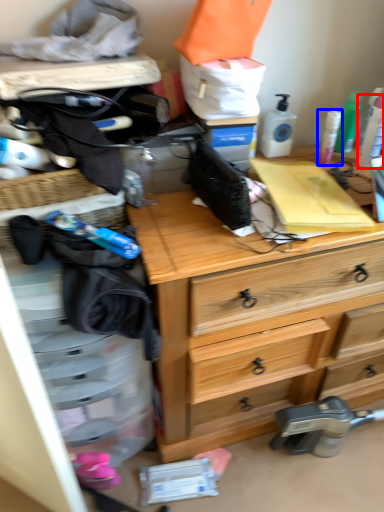
Question: Which object is further to the camera taking this photo, toiletry (highlighted by a red box) or toiletry (highlighted by a blue box)?

Choices:
 (A) toiletry
 (B) toiletry

Answer: (B)